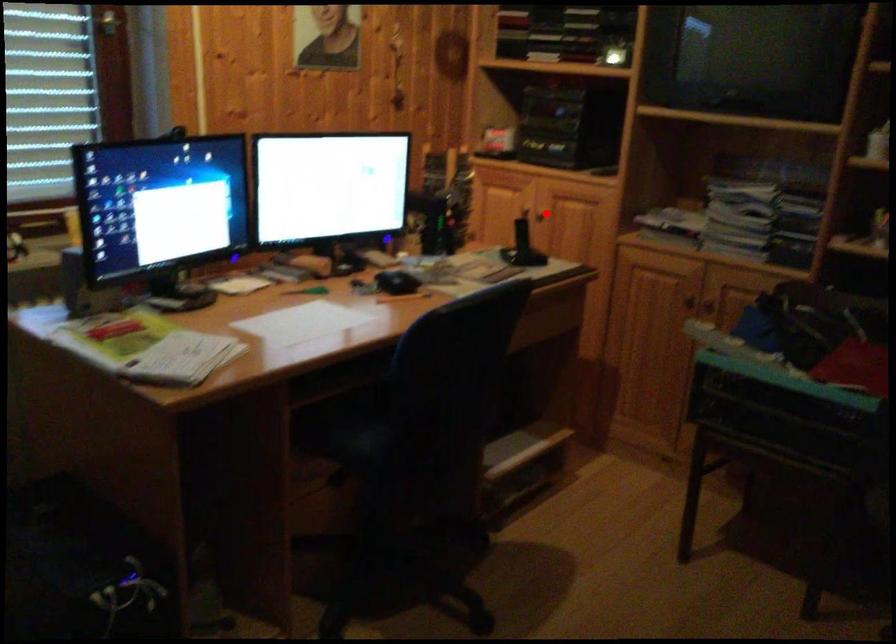
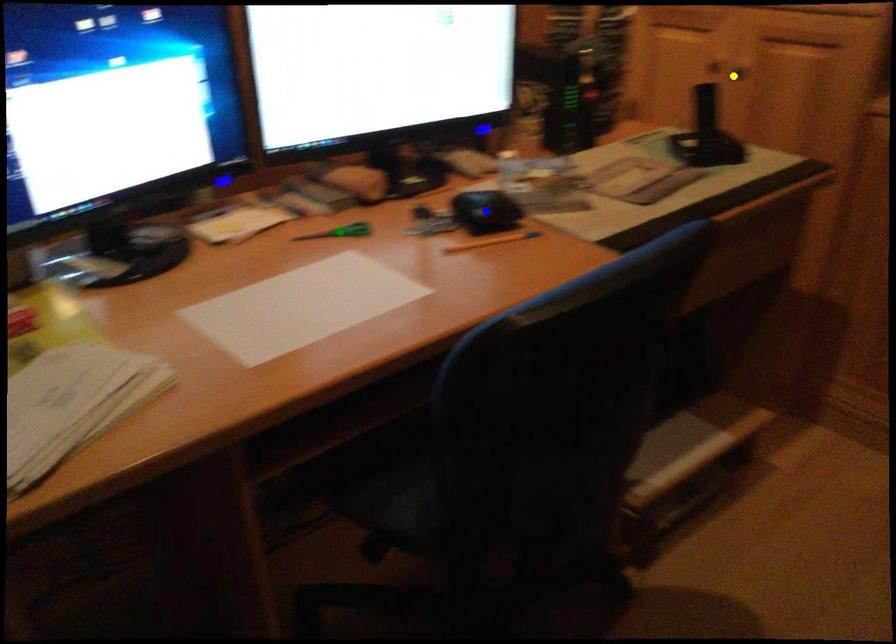
Question: I am providing you with two images of the same scene from different viewpoints. A red point is marked on the first image. You are given multiple points on the second image. Can you choose the point in image 2 that corresponds to the point in image 1?

Choices:
 (A) green point
 (B) yellow point
 (C) blue point

Answer: (B)